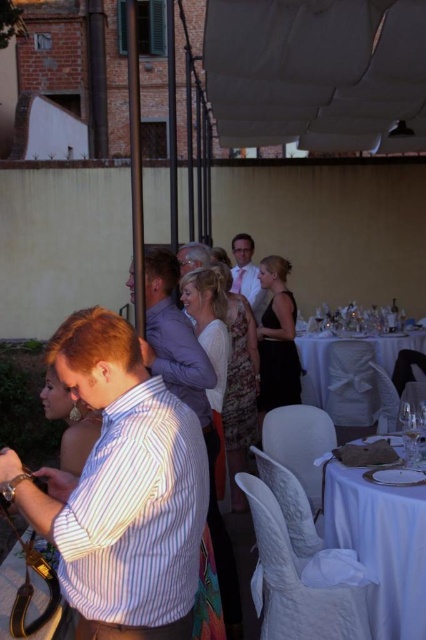
In the scene shown: Is white satin tie at center taller than clear glass wine glass at center?

Correct, white satin tie at center is much taller as clear glass wine glass at center.

Which of these two, white satin tie at center or clear glass wine glass at center, stands taller?

white satin tie at center

This screenshot has height=640, width=426. What are the coordinates of `white satin tie at center` in the screenshot? It's located at (247, 273).

The image size is (426, 640). In order to click on white satin tie at center in this screenshot , I will do `click(247, 273)`.

Can you confirm if white satin tablecloth at lower right is positioned above white satin table at center?

No, white satin tablecloth at lower right is not above white satin table at center.

From the picture: Is the position of white satin tablecloth at lower right less distant than that of white satin table at center?

That is True.

Which is in front, point (359, 512) or point (408, 333)?

Point (359, 512)

I want to click on white satin tablecloth at lower right, so click(380, 545).

Does striped shirt at center have a greater width compared to white satin tie at center?

Correct, the width of striped shirt at center exceeds that of white satin tie at center.

Is point (164, 273) less distant than point (235, 237)?

Yes, it is.

Identify the location of striped shirt at center. Image resolution: width=426 pixels, height=640 pixels. (189, 401).